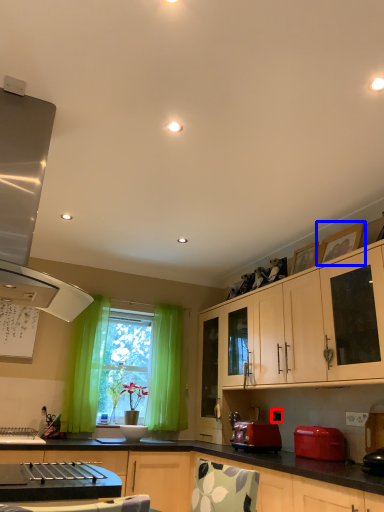
Question: Among these objects, which one is nearest to the camera, power outlet (highlighted by a red box) or picture frame (highlighted by a blue box)?

Choices:
 (A) power outlet
 (B) picture frame

Answer: (B)